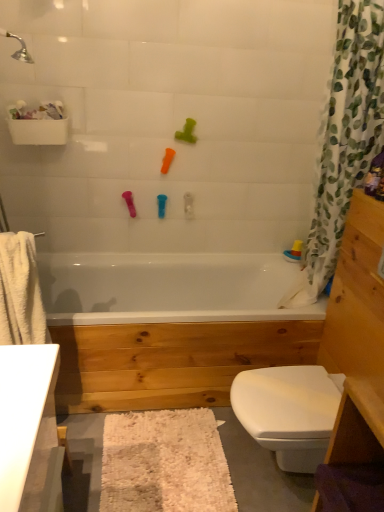
The width and height of the screenshot is (384, 512). What are the coordinates of `white fabric shower curtain at right` in the screenshot? It's located at (344, 138).

This screenshot has height=512, width=384. What do you see at coordinates (161, 205) in the screenshot? I see `blue rubber toy at upper center, the 4th toy positioned from the right` at bounding box center [161, 205].

What do you see at coordinates (129, 203) in the screenshot? The width and height of the screenshot is (384, 512). I see `rubber duck at center, the 1th toy in the left-to-right sequence` at bounding box center [129, 203].

What do you see at coordinates (357, 336) in the screenshot?
I see `light brown wood vanity at right` at bounding box center [357, 336].

Image resolution: width=384 pixels, height=512 pixels. Describe the element at coordinates (164, 463) in the screenshot. I see `white shaggy bath mat at lower center` at that location.

The width and height of the screenshot is (384, 512). I want to click on white fabric shower curtain at right, so click(x=344, y=138).

From a real-world perspective, is blue rubber toy at upper center, the 4th toy positioned from the right, positioned over translucent plastic boat at upper right, which appears as the 5th toy when viewed from the left, based on gravity?

Yes.

Is blue rubber toy at upper center, which ranks as the 2th toy in bottom-to-top order, bigger than translucent plastic boat at upper right, which appears as the 5th toy when viewed from the left?

No.

Is the depth of blue rubber toy at upper center, which ranks as the 2th toy in bottom-to-top order, less than that of translucent plastic boat at upper right, which appears as the 5th toy when viewed from the left?

Yes.

Considering the sizes of objects white fabric shower curtain at right and white glossy bathtub at center in the image provided, who is smaller, white fabric shower curtain at right or white glossy bathtub at center?

white fabric shower curtain at right.

In the scene shown: Is white glossy bathtub at center at the back of white fabric shower curtain at right?

white fabric shower curtain at right does not have its back to white glossy bathtub at center.

Is white fabric shower curtain at right next to white glossy bathtub at center and touching it?

There is a gap between white fabric shower curtain at right and white glossy bathtub at center.

Is white fabric shower curtain at right completely or partially outside of white glossy bathtub at center?

Indeed, white fabric shower curtain at right is completely outside white glossy bathtub at center.

Considering the points (327, 145) and (297, 258), which point is in front, point (327, 145) or point (297, 258)?

The point (327, 145) is closer to the camera.

Considering the relative sizes of white fabric shower curtain at right and translucent plastic boat at upper right, which ranks as the first toy in right-to-left order, in the image provided, is white fabric shower curtain at right shorter than translucent plastic boat at upper right, which ranks as the first toy in right-to-left order,?

No.

Between white fabric shower curtain at right and translucent plastic boat at upper right, which appears as the 5th toy when viewed from the left, which one is positioned behind?

translucent plastic boat at upper right, which appears as the 5th toy when viewed from the left, is behind.

Who is shorter, translucent plastic boat at upper right, the first toy from the bottom, or green rubber toy at upper center, marked as the fourth toy in a left-to-right arrangement?

translucent plastic boat at upper right, the first toy from the bottom.

Could you tell me if translucent plastic boat at upper right, positioned as the fifth toy in top-to-bottom order, is turned towards green rubber toy at upper center, marked as the fourth toy in a left-to-right arrangement?

No, translucent plastic boat at upper right, positioned as the fifth toy in top-to-bottom order, is not aimed at green rubber toy at upper center, marked as the fourth toy in a left-to-right arrangement.

From a real-world perspective, is translucent plastic boat at upper right, the first toy from the bottom, below green rubber toy at upper center, marked as the fourth toy in a left-to-right arrangement?

Yes, from a real-world perspective, translucent plastic boat at upper right, the first toy from the bottom, is under green rubber toy at upper center, marked as the fourth toy in a left-to-right arrangement.

Which point is more forward, (124, 193) or (81, 411)?

The point (81, 411) is closer.

Is rubber duck at center, the 1th toy in the left-to-right sequence, to the left of white glossy bathtub at center from the viewer's perspective?

Indeed, rubber duck at center, the 1th toy in the left-to-right sequence, is positioned on the left side of white glossy bathtub at center.

Is rubber duck at center, positioned as the 3th toy in bottom-to-top order, turned away from white glossy bathtub at center?

rubber duck at center, positioned as the 3th toy in bottom-to-top order, does not have its back to white glossy bathtub at center.

From a real-world perspective, is rubber duck at center, the 5th toy positioned from the right, over white glossy bathtub at center?

Correct, in the physical world, rubber duck at center, the 5th toy positioned from the right, is higher than white glossy bathtub at center.

Consider the image. Can you confirm if green rubber toy at upper center, marked as the second toy in a right-to-left arrangement, is thinner than translucent plastic boat at upper right, which ranks as the first toy in right-to-left order?

No.

Considering the sizes of objects green rubber toy at upper center, the 5th toy ordered from the bottom, and translucent plastic boat at upper right, positioned as the fifth toy in top-to-bottom order, in the image provided, who is smaller, green rubber toy at upper center, the 5th toy ordered from the bottom, or translucent plastic boat at upper right, positioned as the fifth toy in top-to-bottom order,?

translucent plastic boat at upper right, positioned as the fifth toy in top-to-bottom order, is smaller.

Can we say green rubber toy at upper center, marked as the fourth toy in a left-to-right arrangement, lies outside translucent plastic boat at upper right, which appears as the 5th toy when viewed from the left?

Yes, green rubber toy at upper center, marked as the fourth toy in a left-to-right arrangement, is outside of translucent plastic boat at upper right, which appears as the 5th toy when viewed from the left.

From a real-world perspective, relative to translucent plastic boat at upper right, positioned as the fifth toy in top-to-bottom order, is green rubber toy at upper center, marked as the fourth toy in a left-to-right arrangement, vertically above or below?

From a real-world perspective, green rubber toy at upper center, marked as the fourth toy in a left-to-right arrangement, is physically above translucent plastic boat at upper right, positioned as the fifth toy in top-to-bottom order.

The height and width of the screenshot is (512, 384). Identify the location of vanity below the white fabric shower curtain at right (from a real-world perspective). (357, 336).

Is white fabric shower curtain at right facing towards light brown wood vanity at right?

Yes, white fabric shower curtain at right is facing light brown wood vanity at right.

From the image's perspective, which object appears higher, white fabric shower curtain at right or light brown wood vanity at right?

From the image's view, white fabric shower curtain at right is above.

From the image's perspective, count 1st toys upward from the translucent plastic boat at upper right, which appears as the 5th toy when viewed from the left, and point to it. Please provide its 2D coordinates.

[(161, 205)]

The image size is (384, 512). I want to click on shower curtain that is on the right side of white glossy bathtub at center, so click(344, 138).

Considering their positions, is green rubber toy at upper center, the 5th toy ordered from the bottom, positioned further to light brown wood vanity at right than white shaggy bath mat at lower center?

Based on the image, green rubber toy at upper center, the 5th toy ordered from the bottom, appears to be further to light brown wood vanity at right.

Looking at the image, which one is located closer to light brown wood vanity at right, white glossy bathtub at center or rubber duck at center, placed as the 3th toy when sorted from top to bottom?

The object closer to light brown wood vanity at right is white glossy bathtub at center.

Considering their positions, is orange rubber toy at upper center, which is the third toy from left to right, positioned closer to white shaggy bath mat at lower center than white glossy bathtub at center?

white glossy bathtub at center is positioned closer to the anchor white shaggy bath mat at lower center.

Considering their positions, is orange rubber toy at upper center, the second toy when ordered from top to bottom, positioned further to blue rubber toy at upper center, which ranks as the 2th toy in bottom-to-top order, than green rubber toy at upper center, marked as the second toy in a right-to-left arrangement?

Among the two, green rubber toy at upper center, marked as the second toy in a right-to-left arrangement, is located further to blue rubber toy at upper center, which ranks as the 2th toy in bottom-to-top order.

Looking at the image, which one is located further to white shaggy bath mat at lower center, rubber duck at center, placed as the 3th toy when sorted from top to bottom, or white glossy bathtub at center?

Based on the image, rubber duck at center, placed as the 3th toy when sorted from top to bottom, appears to be further to white shaggy bath mat at lower center.

From the image, which object appears to be farther from translucent plastic boat at upper right, the first toy from the bottom, white shaggy bath mat at lower center or blue rubber toy at upper center, the 4th toy from the top?

white shaggy bath mat at lower center lies further to translucent plastic boat at upper right, the first toy from the bottom, than the other object.

From the picture: From the image, which object appears to be nearer to white glossy bathtub at center, white shaggy bath mat at lower center or rubber duck at center, the 1th toy in the left-to-right sequence?

Based on the image, white shaggy bath mat at lower center appears to be nearer to white glossy bathtub at center.

Estimate the real-world distances between objects in this image. Which object is further from white fabric shower curtain at right, blue rubber toy at upper center, which ranks as the 2th toy in bottom-to-top order, or rubber duck at center, placed as the 3th toy when sorted from top to bottom?

rubber duck at center, placed as the 3th toy when sorted from top to bottom, is further to white fabric shower curtain at right.

Where is `toy between orange rubber toy at upper center, which is the third toy from left to right, and translucent plastic boat at upper right, the first toy from the bottom`? This screenshot has height=512, width=384. toy between orange rubber toy at upper center, which is the third toy from left to right, and translucent plastic boat at upper right, the first toy from the bottom is located at coordinates (187, 132).

This screenshot has width=384, height=512. I want to click on bathtub located between blue rubber toy at upper center, which is counted as the second toy, starting from the left, and light brown wood vanity at right in the left-right direction, so click(x=168, y=327).

Where is `bathtub between orange rubber toy at upper center, arranged as the 4th toy when ordered from the bottom, and white shaggy bath mat at lower center vertically`? bathtub between orange rubber toy at upper center, arranged as the 4th toy when ordered from the bottom, and white shaggy bath mat at lower center vertically is located at coordinates (168, 327).

Find the location of `bathtub between white fabric shower curtain at right and blue rubber toy at upper center, which is counted as the second toy, starting from the left, in the front-back direction`. bathtub between white fabric shower curtain at right and blue rubber toy at upper center, which is counted as the second toy, starting from the left, in the front-back direction is located at coordinates (168, 327).